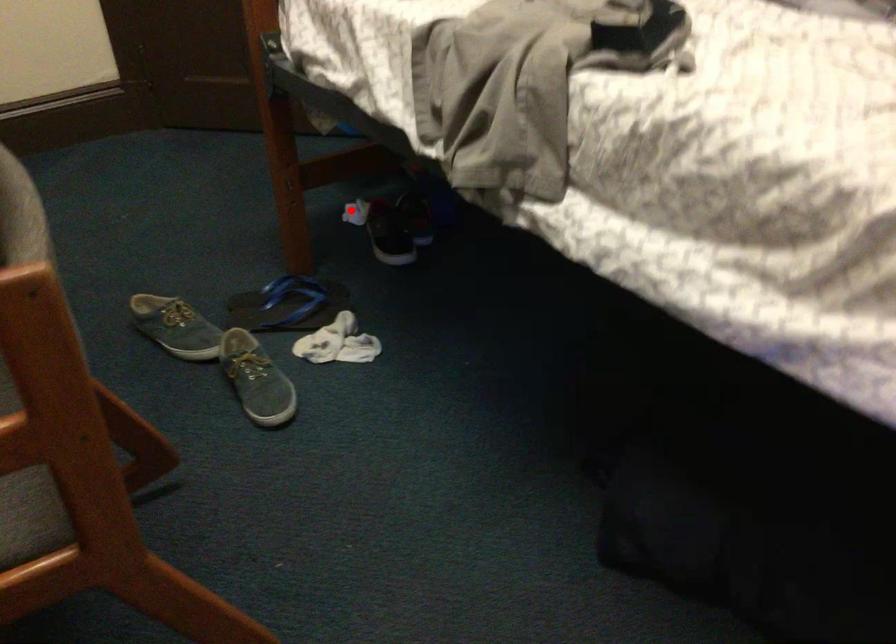
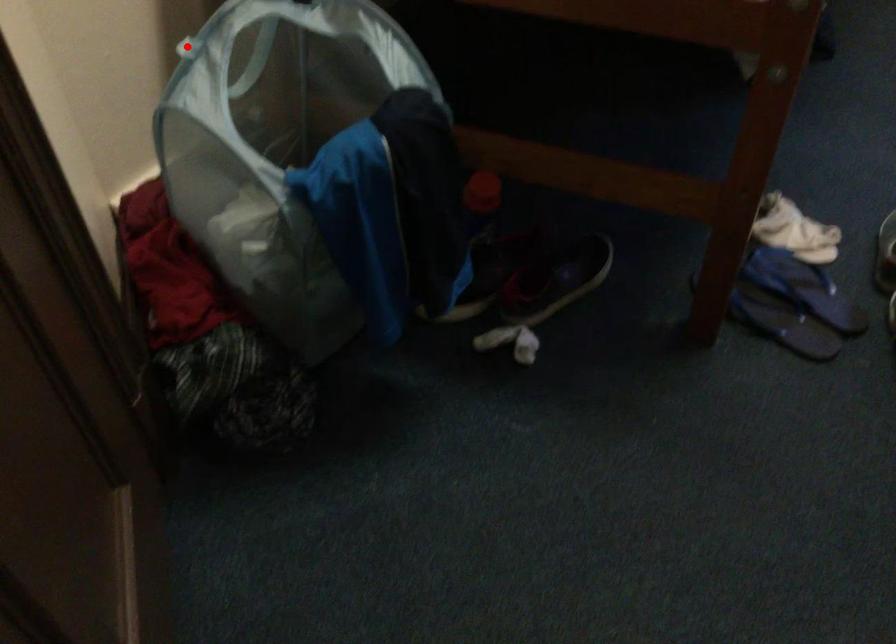
From the picture: I am providing you with two images of the same scene from different viewpoints. A red point is marked on the first image and another point is marked on the second image. Is the red point in image1 aligned with the point shown in image2?

No